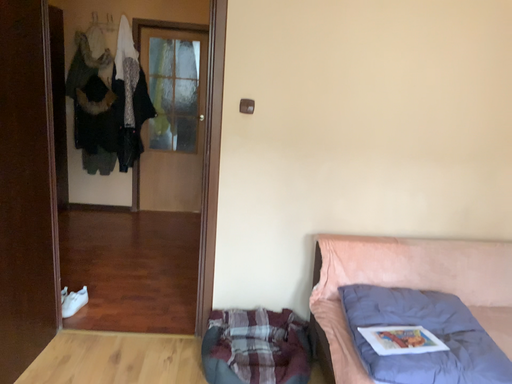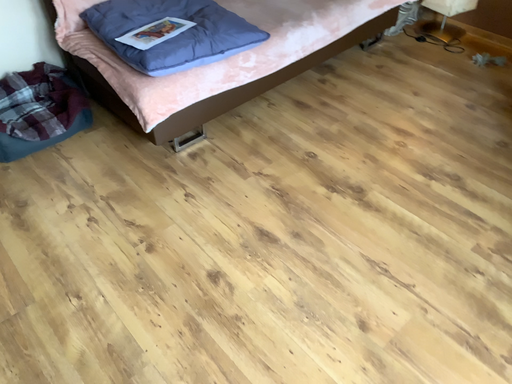
Question: Which way did the camera rotate in the video?

Choices:
 (A) rotated right
 (B) rotated left

Answer: (A)